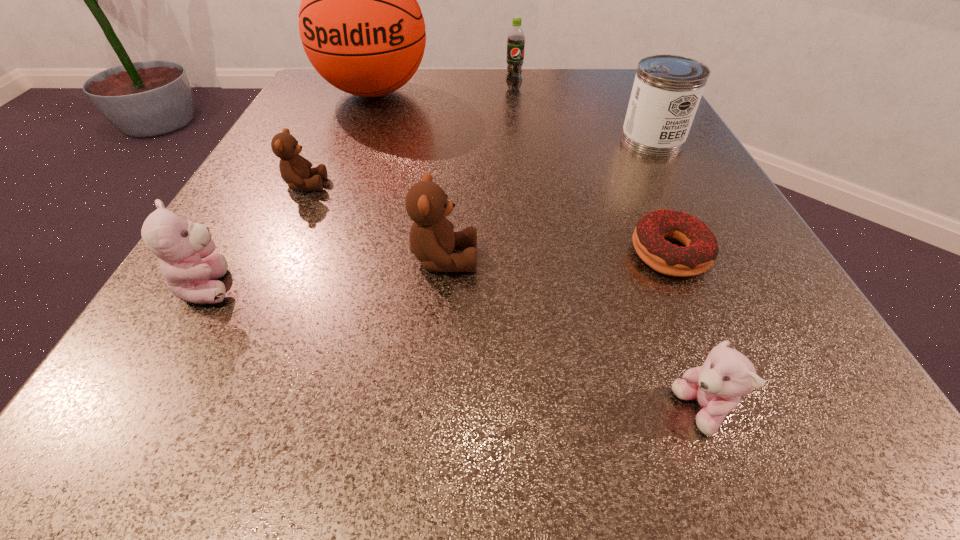
Find the location of a particular element. The image size is (960, 540). the tallest object is located at coordinates (361, 27).

Find the location of a particular element. Image resolution: width=960 pixels, height=540 pixels. green soda is located at coordinates (516, 39).

Identify the location of the fourth object from right to left. The width and height of the screenshot is (960, 540). (516, 39).

Identify the location of the third farthest object. The image size is (960, 540). (667, 89).

Identify the location of the right brown teddy bear. (432, 240).

You are a GUI agent. You are given a task and a screenshot of the screen. Output one action in this format:
    pyautogui.click(x=<x>, y=<y>)
    Task: Click on the third teddy bear from left to right
    
    Given the screenshot: What is the action you would take?
    pyautogui.click(x=432, y=240)

At what (x,y) coordinates should I click in order to perform the action: click on the farther pink teddy bear. Please return your answer as a coordinate pair (x, y). Image resolution: width=960 pixels, height=540 pixels. Looking at the image, I should click on (180, 246).

The width and height of the screenshot is (960, 540). In order to click on the bigger pink teddy bear in this screenshot , I will do `click(180, 246)`.

This screenshot has height=540, width=960. I want to click on the smaller brown teddy bear, so click(295, 170).

Find the location of a particular element. The width and height of the screenshot is (960, 540). the fifth nearest object is located at coordinates (295, 170).